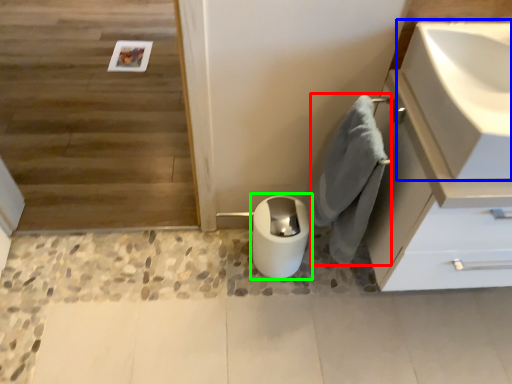
Question: Considering the real-world distances, which object is closest to bath towel (highlighted by a red box)? sink (highlighted by a blue box) or toilet bowl (highlighted by a green box).

Choices:
 (A) sink
 (B) toilet bowl

Answer: (B)